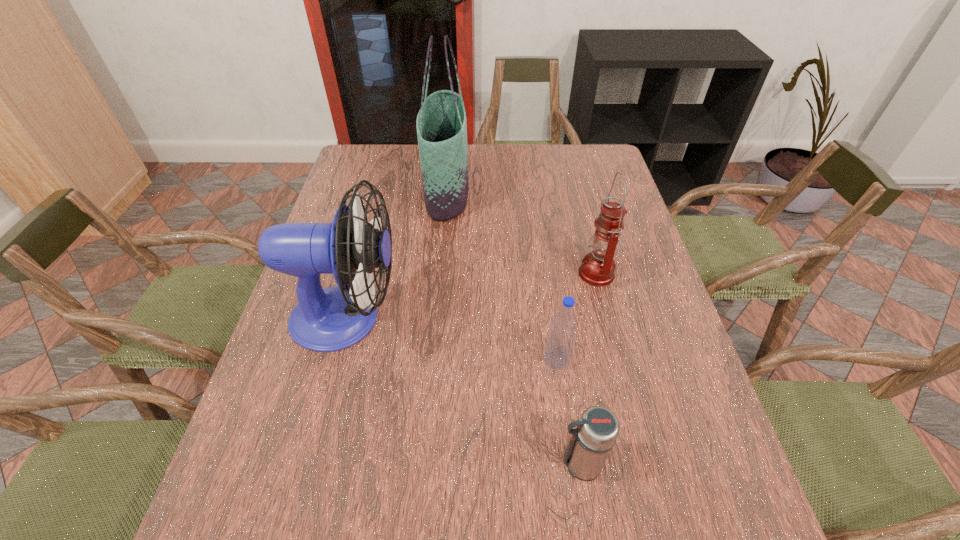
Locate an element on the screen. vacant area located 0.230m on the left of the oil lamp is located at coordinates (492, 273).

You are a GUI agent. You are given a task and a screenshot of the screen. Output one action in this format:
    pyautogui.click(x=<x>, y=<y>)
    Task: Click on the free space located 0.360m on the left of the water bottle
    The height and width of the screenshot is (540, 960).
    Given the screenshot: What is the action you would take?
    pyautogui.click(x=382, y=359)

Find the location of a particular element. blank area located 0.360m with a handle on the side of the thermos bottle is located at coordinates (365, 463).

The height and width of the screenshot is (540, 960). I want to click on free space located with a handle on the side of the thermos bottle, so click(445, 463).

At what (x,y) coordinates should I click in order to perform the action: click on free space located 0.050m with a handle on the side of the thermos bottle. Please return your answer as a coordinate pair (x, y). Looking at the image, I should click on (531, 463).

Where is `object that is positioned at the far edge`? Image resolution: width=960 pixels, height=540 pixels. object that is positioned at the far edge is located at coordinates (441, 124).

I want to click on object that is positioned at the left edge, so click(x=325, y=320).

Where is `object present at the right edge`? This screenshot has width=960, height=540. object present at the right edge is located at coordinates (597, 269).

The width and height of the screenshot is (960, 540). What are the coordinates of `vacant space at the far edge of the desktop` in the screenshot? It's located at (557, 146).

This screenshot has width=960, height=540. What are the coordinates of `free location at the near edge` in the screenshot? It's located at (572, 522).